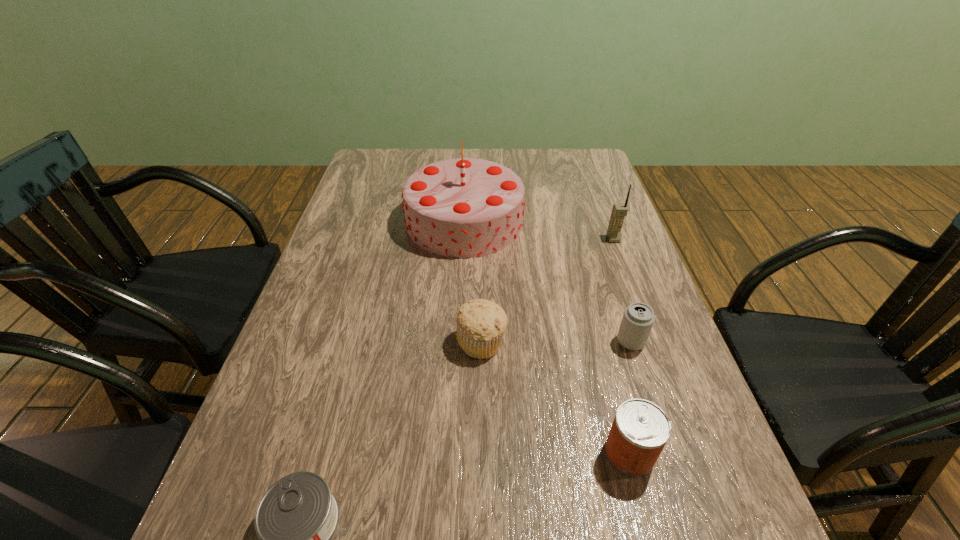
The width and height of the screenshot is (960, 540). What are the coordinates of `birthday cake` in the screenshot? It's located at (462, 208).

At what (x,y) coordinates should I click in order to perform the action: click on the fifth shortest object. Please return your answer as a coordinate pair (x, y). Image resolution: width=960 pixels, height=540 pixels. Looking at the image, I should click on (619, 211).

At what (x,y) coordinates should I click in order to perform the action: click on muffin. Please return your answer as a coordinate pair (x, y). Looking at the image, I should click on (481, 323).

The width and height of the screenshot is (960, 540). In order to click on the fifth farthest object in this screenshot , I will do `click(640, 430)`.

I want to click on the farthest can, so click(638, 318).

Where is `free space located on the right of the tallest object`? This screenshot has width=960, height=540. free space located on the right of the tallest object is located at coordinates (626, 221).

What are the coordinates of `blank space located on the front of the cellular telephone, where the keypad is located` in the screenshot? It's located at (653, 346).

You are a GUI agent. You are given a task and a screenshot of the screen. Output one action in this format:
    pyautogui.click(x=<x>, y=<y>)
    Task: Click on the blank area located 0.260m on the right of the muffin
    This screenshot has height=540, width=960.
    Given the screenshot: What is the action you would take?
    pyautogui.click(x=628, y=342)

Image resolution: width=960 pixels, height=540 pixels. Identify the location of vacant space located 0.180m on the back of the second farthest can. (603, 352).

Where is `vacant space located on the front of the farthest can`? The height and width of the screenshot is (540, 960). vacant space located on the front of the farthest can is located at coordinates (655, 416).